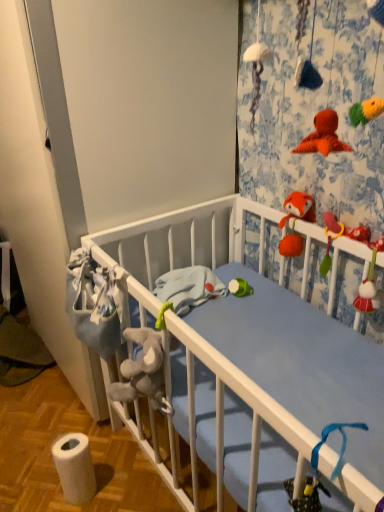
Where is `unoccupied region to the right of white matte toilet paper at lower left`? The image size is (384, 512). unoccupied region to the right of white matte toilet paper at lower left is located at coordinates (127, 486).